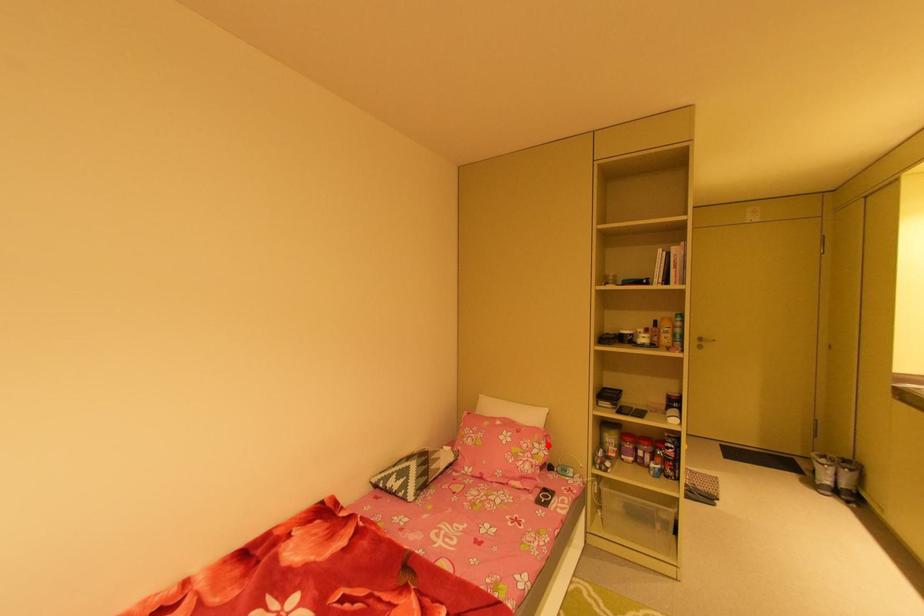
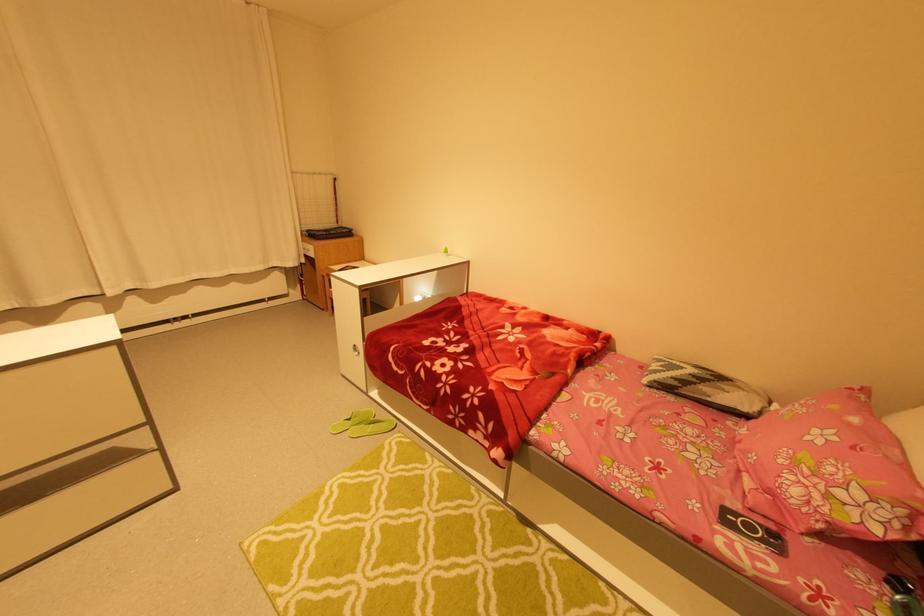
Where in the second image is the point corresponding to the highlighted location from the first image?

(891, 515)